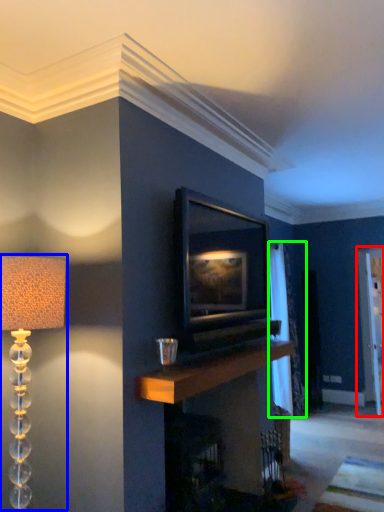
Question: Estimate the real-world distances between objects in this image. Which object is closer to glass door (highlighted by a red box), lamp (highlighted by a blue box) or curtain (highlighted by a green box)?

Choices:
 (A) lamp
 (B) curtain

Answer: (B)